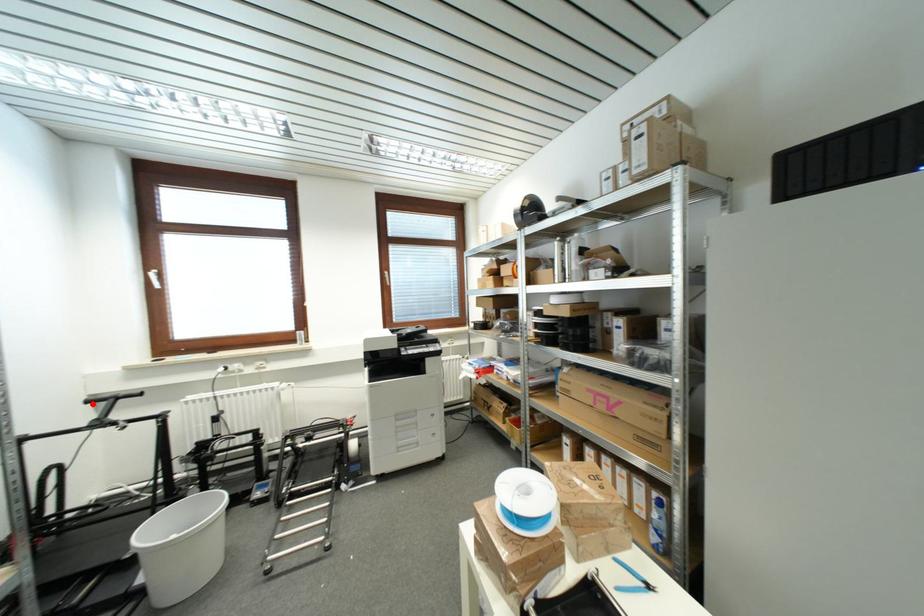
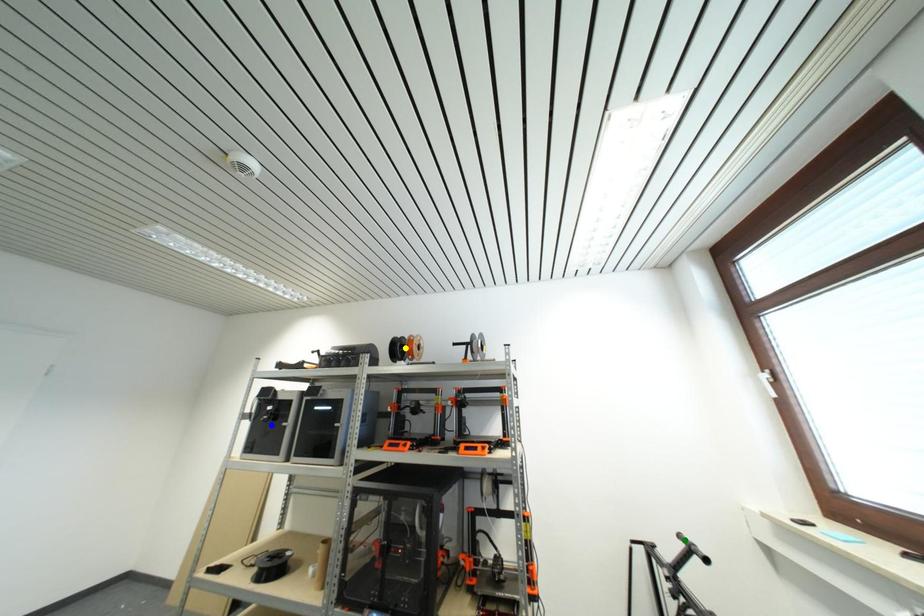
Question: I am providing you with two images of the same scene from different viewpoints. A red point is marked on the first image. You are given multiple points on the second image. In image 2, which mark is for the same physical point as the one in image 1?

Choices:
 (A) yellow point
 (B) blue point
 (C) green point

Answer: (C)